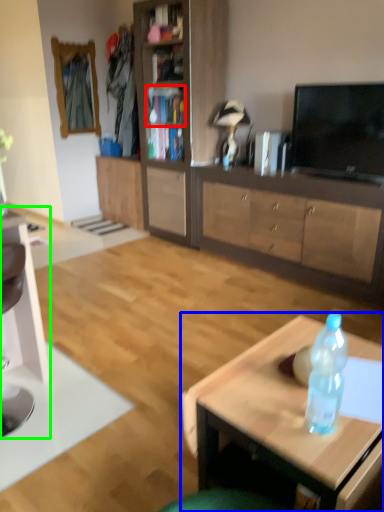
Question: Which object is positioned closest to cabinet (highlighted by a red box)? Select from coffee table (highlighted by a blue box) and computer desk (highlighted by a green box).

Choices:
 (A) coffee table
 (B) computer desk

Answer: (B)